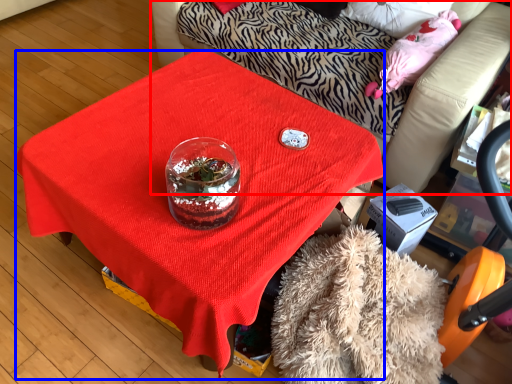
Question: Which object is closer to the camera taking this photo, furniture (highlighted by a red box) or desk (highlighted by a blue box)?

Choices:
 (A) furniture
 (B) desk

Answer: (B)